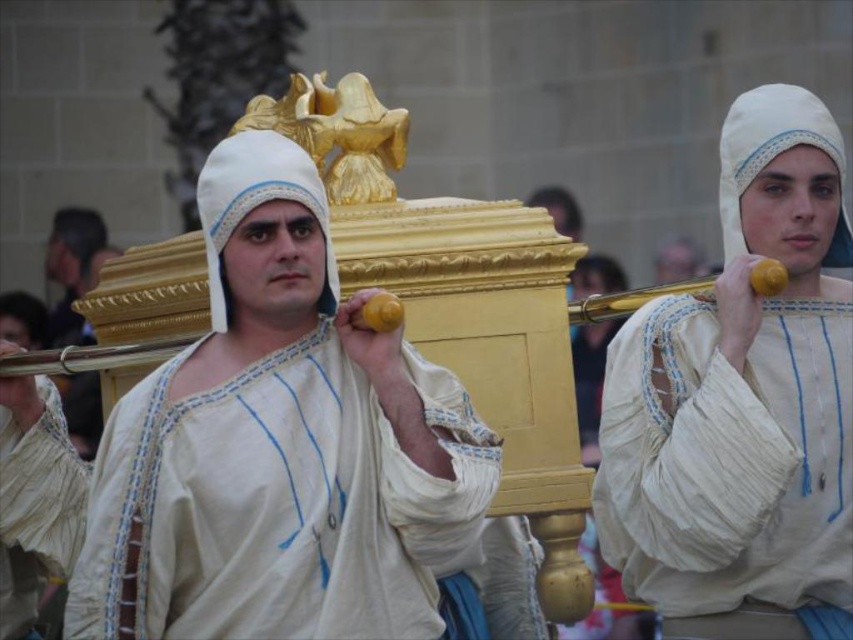
You are a photographer standing at the camera position. You want to take a closeup shot of the matte gold casket at center. Given that your camera can focus up to 150 feet, will you be able to capture the casket clearly?

The matte gold casket at center is 180.77 feet from the camera, which exceeds the camera focus limit of 150 feet. Therefore, the photographer cannot capture the casket clearly in a closeup shot.

You are a photographer trying to capture the matte gold casket at center and the white cotton headscarf at upper right in a single frame. Based on their sizes, which object should you focus on first to ensure both are in the frame?

The matte gold casket at center is shorter than the white cotton headscarf at upper right, so you should focus on the white cotton headscarf at upper right first to ensure both are in the frame.